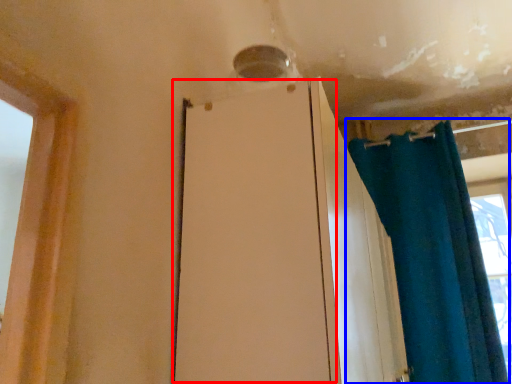
Question: Which object appears farthest to the camera in this image, screen door (highlighted by a red box) or curtain (highlighted by a blue box)?

Choices:
 (A) screen door
 (B) curtain

Answer: (B)